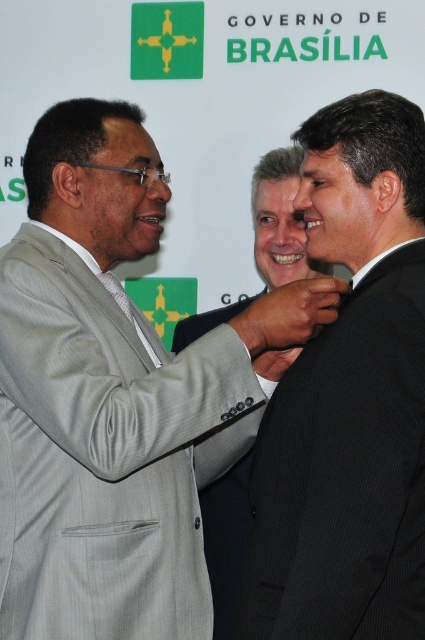
You are a photographer at the event and need to ensure the black textured suit at center and dark brown leather hand at center are both visible in the photo. Given their sizes, which object should you focus on to ensure both are in frame?

The black textured suit at center is wider than the dark brown leather hand at center, so focusing on the larger black textured suit at center will ensure both objects are within the frame.

You are attending a formal event and notice two men wearing suits. The first man is wearing a light gray pinstripe suit at center, and the second is wearing a black textured suit at center. Based on the scene description, which suit is positioned to the left?

The light gray pinstripe suit at center is to the left of the black textured suit at center.